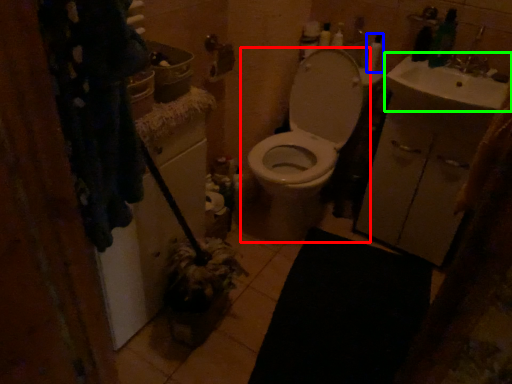
Question: Which is nearer to the toilet (highlighted by a red box)? toiletry (highlighted by a blue box) or sink (highlighted by a green box).

Choices:
 (A) toiletry
 (B) sink

Answer: (B)